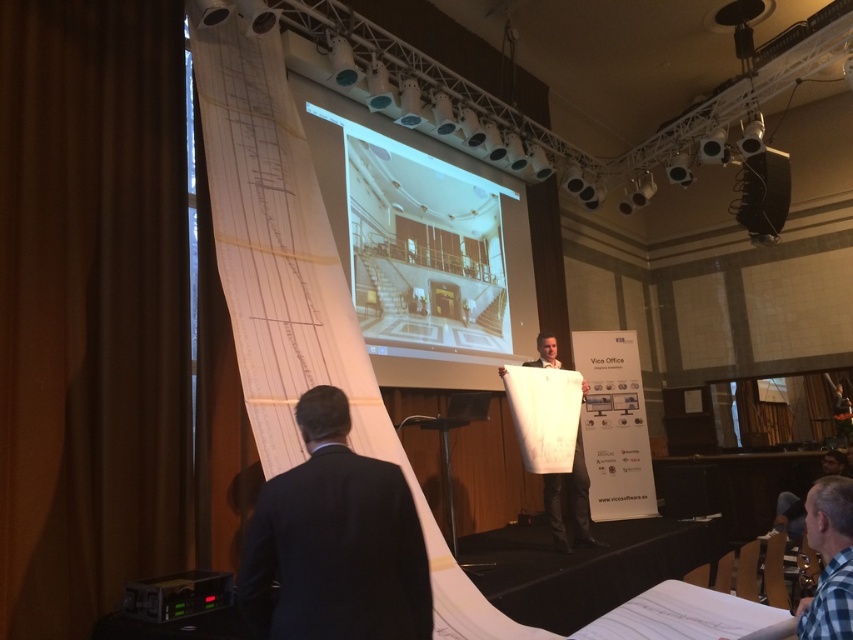
Question: Which object is closer to the camera taking this photo?

Choices:
 (A) white paper at center
 (B) checkered fabric shirt at lower right
 (C) dark suit at lower left

Answer: (C)

Question: Does white matte projection screen at center have a larger size compared to checkered fabric shirt at lower right?

Choices:
 (A) no
 (B) yes

Answer: (B)

Question: Which point is farther to the camera?

Choices:
 (A) dark suit at lower left
 (B) white paper at center
 (C) white matte projection screen at center
 (D) brown fabric curtain at left

Answer: (C)

Question: Based on their relative distances, which object is nearer to the checkered fabric shirt at lower right?

Choices:
 (A) brown fabric curtain at left
 (B) dark suit at lower left
 (C) white paper at center

Answer: (B)

Question: Can you confirm if dark suit at lower left is positioned below white paper at center?

Choices:
 (A) no
 (B) yes

Answer: (A)

Question: Does dark suit at lower left lie in front of checkered fabric shirt at lower right?

Choices:
 (A) no
 (B) yes

Answer: (B)